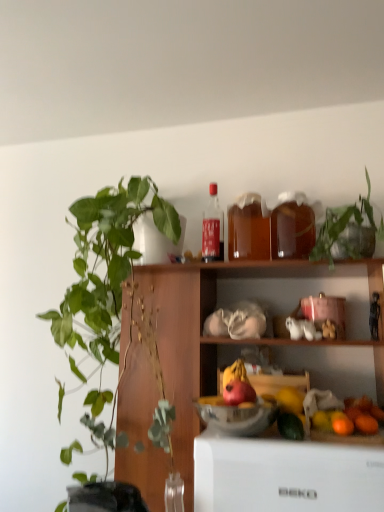
You are a GUI agent. You are given a task and a screenshot of the screen. Output one action in this format:
    pyautogui.click(x=<x>, y=<y>)
    Task: Click on the metallic silver bowl at center
    
    Given the screenshot: What is the action you would take?
    pyautogui.click(x=236, y=415)

Locate an element on the screen. The image size is (384, 512). translucent glass bottle at upper center, arranged as the 2th bottle when viewed from the right is located at coordinates (248, 229).

At what (x,y) coordinates should I click in order to perform the action: click on orange matte at lower right. Please return your answer as a coordinate pair (x, y). Image resolution: width=384 pixels, height=512 pixels. Looking at the image, I should click on (321, 421).

The image size is (384, 512). I want to click on translucent amber bottle at upper center, which ranks as the 1th bottle in right-to-left order, so click(292, 226).

Which object is closer to the camera, orange matte at lower right or green leafy plant at left, the 2th houseplant from the right?

green leafy plant at left, the 2th houseplant from the right, is in front.

How different are the orientations of orange matte at lower right and green leafy plant at left, the 2th houseplant from the right, in degrees?

The angular difference between orange matte at lower right and green leafy plant at left, the 2th houseplant from the right, is 89.8 degrees.

From the image's perspective, is orange matte at lower right under green leafy plant at left, the 2th houseplant from the right?

Indeed, from the image's perspective, orange matte at lower right is shown beneath green leafy plant at left, the 2th houseplant from the right.

Can you tell me how much green leafy plant at upper right, which appears as the 2th houseplant when viewed from the left, and matte glass bottle at upper center, arranged as the 3th bottle when viewed from the right, differ in facing direction?

There is a 1.39-degree angle between the facing directions of green leafy plant at upper right, which appears as the 2th houseplant when viewed from the left, and matte glass bottle at upper center, arranged as the 3th bottle when viewed from the right.

From a real-world perspective, is green leafy plant at upper right, which appears as the 2th houseplant when viewed from the left, physically below matte glass bottle at upper center, positioned as the first bottle in left-to-right order?

Yes, from a real-world perspective, green leafy plant at upper right, which appears as the 2th houseplant when viewed from the left, is under matte glass bottle at upper center, positioned as the first bottle in left-to-right order.

Could you tell me if green leafy plant at upper right, which is the 1th houseplant in right-to-left order, is turned towards matte glass bottle at upper center, positioned as the first bottle in left-to-right order?

No, green leafy plant at upper right, which is the 1th houseplant in right-to-left order, is not facing towards matte glass bottle at upper center, positioned as the first bottle in left-to-right order.

Considering their positions, is green leafy plant at upper right, which appears as the 2th houseplant when viewed from the left, located in front of or behind matte glass bottle at upper center, arranged as the 3th bottle when viewed from the right?

green leafy plant at upper right, which appears as the 2th houseplant when viewed from the left, is in front of matte glass bottle at upper center, arranged as the 3th bottle when viewed from the right.

Is green leafy plant at upper right, which is the 1th houseplant in right-to-left order, at the back of red matte apple at center?

red matte apple at center is not turned away from green leafy plant at upper right, which is the 1th houseplant in right-to-left order.

Considering the relative positions of red matte apple at center and green leafy plant at upper right, which is the 1th houseplant in right-to-left order, in the image provided, is red matte apple at center to the right of green leafy plant at upper right, which is the 1th houseplant in right-to-left order, from the viewer's perspective?

In fact, red matte apple at center is to the left of green leafy plant at upper right, which is the 1th houseplant in right-to-left order.

From a real-world perspective, is red matte apple at center located higher than green leafy plant at upper right, which is the 1th houseplant in right-to-left order?

No.

Can you confirm if green leafy plant at upper right, which appears as the 2th houseplant when viewed from the left, is bigger than green leafy plant at left, which is counted as the first houseplant, starting from the left?

No.

Considering the relative sizes of green leafy plant at upper right, which is the 1th houseplant in right-to-left order, and green leafy plant at left, the 2th houseplant from the right, in the image provided, is green leafy plant at upper right, which is the 1th houseplant in right-to-left order, thinner than green leafy plant at left, the 2th houseplant from the right,?

Indeed, green leafy plant at upper right, which is the 1th houseplant in right-to-left order, has a lesser width compared to green leafy plant at left, the 2th houseplant from the right.

Which object is more forward, green leafy plant at upper right, which is the 1th houseplant in right-to-left order, or green leafy plant at left, the 2th houseplant from the right?

green leafy plant at left, the 2th houseplant from the right, is more forward.

Considering the positions of objects green leafy plant at upper right, which is the 1th houseplant in right-to-left order, and green leafy plant at left, the 2th houseplant from the right, in the image provided, who is more to the right, green leafy plant at upper right, which is the 1th houseplant in right-to-left order, or green leafy plant at left, the 2th houseplant from the right,?

Positioned to the right is green leafy plant at upper right, which is the 1th houseplant in right-to-left order.

Considering the sizes of objects green leafy plant at left, which is counted as the first houseplant, starting from the left, and green leafy plant at upper right, which is the 1th houseplant in right-to-left order, in the image provided, who is bigger, green leafy plant at left, which is counted as the first houseplant, starting from the left, or green leafy plant at upper right, which is the 1th houseplant in right-to-left order,?

With larger size is green leafy plant at left, which is counted as the first houseplant, starting from the left.

Looking at this image, would you say green leafy plant at left, which is counted as the first houseplant, starting from the left, is to the left or to the right of green leafy plant at upper right, which is the 1th houseplant in right-to-left order, in the picture?

Based on their positions, green leafy plant at left, which is counted as the first houseplant, starting from the left, is located to the left of green leafy plant at upper right, which is the 1th houseplant in right-to-left order.

In the scene shown: Does green leafy plant at left, the 2th houseplant from the right, have a lesser height compared to green leafy plant at upper right, which appears as the 2th houseplant when viewed from the left?

No, green leafy plant at left, the 2th houseplant from the right, is not shorter than green leafy plant at upper right, which appears as the 2th houseplant when viewed from the left.

Could orange matte at lower right be considered to be inside red matte apple at center?

No, orange matte at lower right is not a part of red matte apple at center.

Considering the sizes of objects red matte apple at center and orange matte at lower right in the image provided, who is shorter, red matte apple at center or orange matte at lower right?

Standing shorter between the two is orange matte at lower right.

Does red matte apple at center turn towards orange matte at lower right?

No, red matte apple at center is not oriented towards orange matte at lower right.

Which point is more distant from viewer, (239, 400) or (337, 422)?

The point (337, 422) is more distant.

Which of these two, green leafy plant at upper right, which appears as the 2th houseplant when viewed from the left, or green matte avocado at lower center, is smaller?

green matte avocado at lower center is smaller.

Is green leafy plant at upper right, which is the 1th houseplant in right-to-left order, closer to camera compared to green matte avocado at lower center?

No, it is not.

From a real-world perspective, who is located higher, green leafy plant at upper right, which appears as the 2th houseplant when viewed from the left, or green matte avocado at lower center?

From a 3D spatial view, green leafy plant at upper right, which appears as the 2th houseplant when viewed from the left, is above.

At what (x,y) coordinates should I click in order to perform the action: click on the 1st houseplant above when counting from the orange matte at lower right (from the image's perspective). Please return your answer as a coordinate pair (x, y). Looking at the image, I should click on (106, 264).

From the green leafy plant at upper right, which appears as the 2th houseplant when viewed from the left, count 3rd bottles backward and point to it. Please provide its 2D coordinates.

[(213, 229)]

Estimate the real-world distances between objects in this image. Which object is further from translucent glass bottle at upper center, arranged as the 2th bottle when viewed from the right, red matte apple at center or green leafy plant at upper right, which is the 1th houseplant in right-to-left order?

red matte apple at center is further to translucent glass bottle at upper center, arranged as the 2th bottle when viewed from the right.

From the image, which object appears to be farther from green leafy plant at upper right, which appears as the 2th houseplant when viewed from the left, green matte avocado at lower center or orange matte at lower right?

Among the two, green matte avocado at lower center is located further to green leafy plant at upper right, which appears as the 2th houseplant when viewed from the left.

Looking at the image, which one is located further to translucent glass bottle at upper center, arranged as the 2th bottle when viewed from the right, green leafy plant at upper right, which is the 1th houseplant in right-to-left order, or red matte apple at center?

The object further to translucent glass bottle at upper center, arranged as the 2th bottle when viewed from the right, is red matte apple at center.

Looking at the image, which one is located further to green leafy plant at left, the 2th houseplant from the right, matte glass bottle at upper center, positioned as the first bottle in left-to-right order, or green matte avocado at lower center?

Among the two, green matte avocado at lower center is located further to green leafy plant at left, the 2th houseplant from the right.

From the image, which object appears to be farther from green matte avocado at lower center, orange matte at lower right or translucent amber bottle at upper center, which ranks as the 1th bottle in right-to-left order?

Based on the image, translucent amber bottle at upper center, which ranks as the 1th bottle in right-to-left order, appears to be further to green matte avocado at lower center.

When comparing their distances from translucent amber bottle at upper center, which is counted as the 3th bottle, starting from the left, does metallic silver bowl at center or matte glass bottle at upper center, arranged as the 3th bottle when viewed from the right, seem further?

metallic silver bowl at center lies further to translucent amber bottle at upper center, which is counted as the 3th bottle, starting from the left, than the other object.

Considering their positions, is translucent glass bottle at upper center, the 2th bottle when ordered from left to right, positioned closer to translucent amber bottle at upper center, which ranks as the 1th bottle in right-to-left order, than green leafy plant at upper right, which appears as the 2th houseplant when viewed from the left?

translucent glass bottle at upper center, the 2th bottle when ordered from left to right, is positioned closer to the anchor translucent amber bottle at upper center, which ranks as the 1th bottle in right-to-left order.

Based on their spatial positions, is orange matte at lower right or translucent amber bottle at upper center, which ranks as the 1th bottle in right-to-left order, closer to green matte avocado at lower center?

Based on the image, orange matte at lower right appears to be nearer to green matte avocado at lower center.

This screenshot has width=384, height=512. I want to click on bottle between translucent amber bottle at upper center, which ranks as the 1th bottle in right-to-left order, and green matte avocado at lower center vertically, so click(x=248, y=229).

Where is `vegetable between metallic silver bowl at center and orange matte at lower right from left to right`? Image resolution: width=384 pixels, height=512 pixels. vegetable between metallic silver bowl at center and orange matte at lower right from left to right is located at coordinates (290, 426).

Locate an element on the screen. Image resolution: width=384 pixels, height=512 pixels. bottle between green leafy plant at upper right, which is the 1th houseplant in right-to-left order, and orange matte at lower right from top to bottom is located at coordinates (248, 229).

Where is `orange between matte glass bottle at upper center, arranged as the 3th bottle when viewed from the right, and green matte avocado at lower center vertically`? This screenshot has width=384, height=512. orange between matte glass bottle at upper center, arranged as the 3th bottle when viewed from the right, and green matte avocado at lower center vertically is located at coordinates (341, 423).